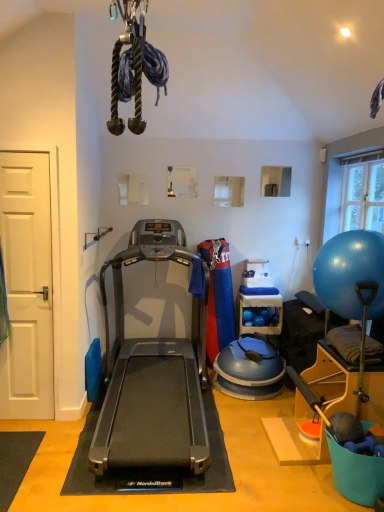
You are a GUI agent. You are given a task and a screenshot of the screen. Output one action in this format:
    pyautogui.click(x=<x>, y=<y>)
    Task: Click on the vacant area that is situated to the right of white matte door at left
    Image resolution: width=384 pixels, height=512 pixels.
    Given the screenshot: What is the action you would take?
    pyautogui.click(x=58, y=421)